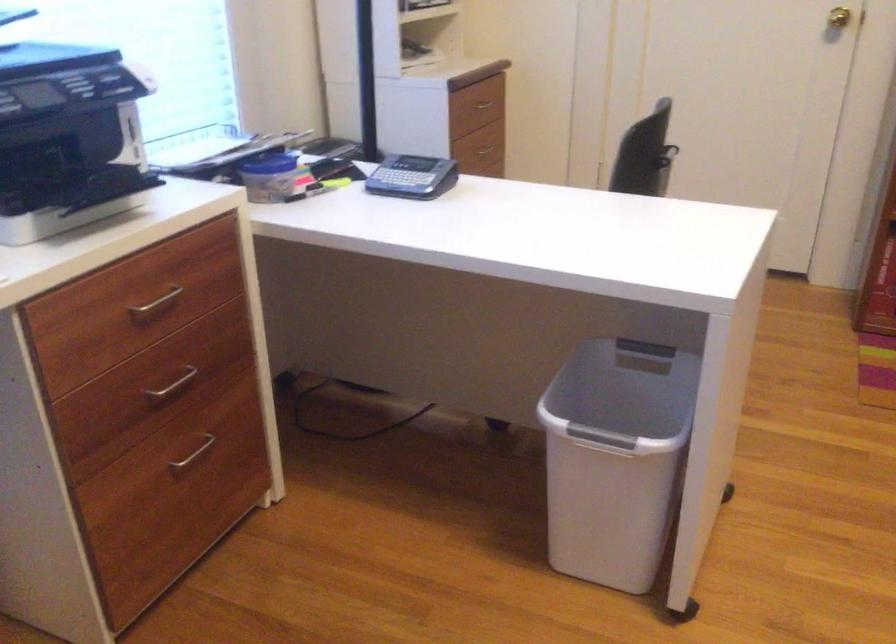
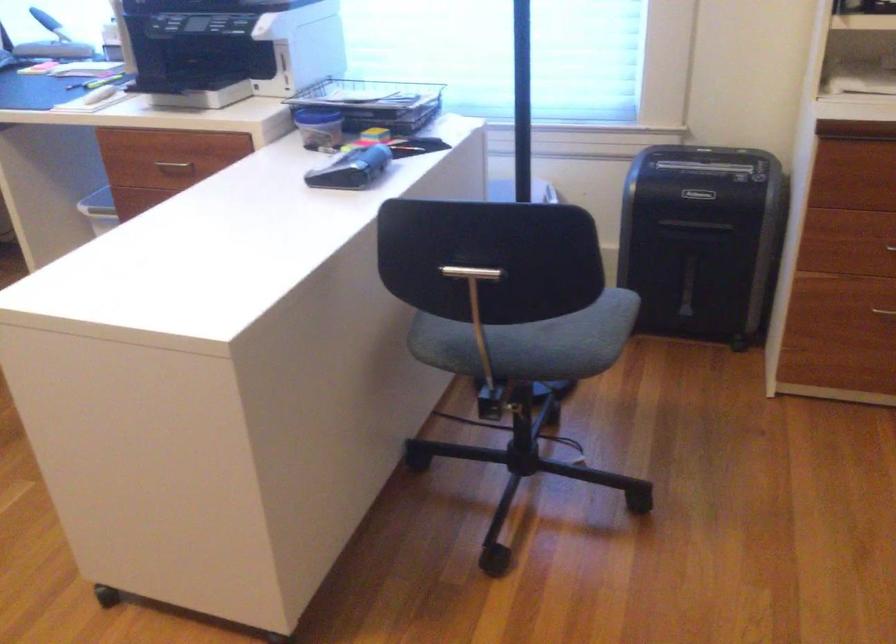
Locate, in the second image, the point that corresponds to [484,151] in the first image.

(890, 247)